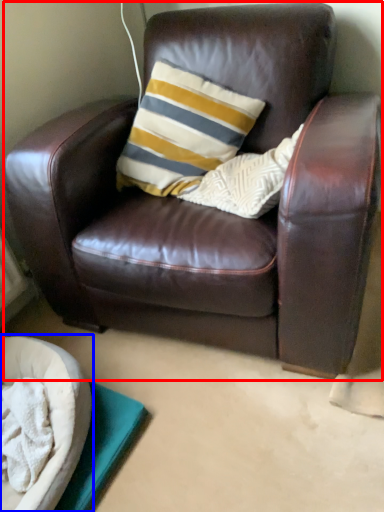
Question: Which object is closer to the camera taking this photo, chair (highlighted by a red box) or dog bed (highlighted by a blue box)?

Choices:
 (A) chair
 (B) dog bed

Answer: (A)